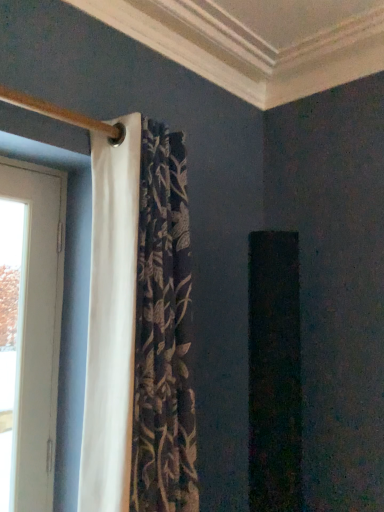
Question: From a real-world perspective, is white wood door at left over white fabric curtain at left?

Choices:
 (A) no
 (B) yes

Answer: (A)

Question: Is white fabric curtain at left at the back of white wood door at left?

Choices:
 (A) no
 (B) yes

Answer: (A)

Question: Is white wood door at left next to white fabric curtain at left and touching it?

Choices:
 (A) no
 (B) yes

Answer: (A)

Question: Is the position of white wood door at left less distant than that of white fabric curtain at left?

Choices:
 (A) yes
 (B) no

Answer: (B)

Question: Is white wood door at left not close to white fabric curtain at left?

Choices:
 (A) no
 (B) yes

Answer: (A)

Question: From the image's perspective, would you say white wood door at left is positioned over white fabric curtain at left?

Choices:
 (A) no
 (B) yes

Answer: (A)

Question: Is white fabric curtain at left next to white wood door at left and touching it?

Choices:
 (A) yes
 (B) no

Answer: (B)

Question: Is white fabric curtain at left at the right side of white wood door at left?

Choices:
 (A) yes
 (B) no

Answer: (A)

Question: Is white fabric curtain at left not within white wood door at left?

Choices:
 (A) yes
 (B) no

Answer: (A)

Question: Is white fabric curtain at left wider than white wood door at left?

Choices:
 (A) yes
 (B) no

Answer: (A)

Question: Is white wood door at left located within white fabric curtain at left?

Choices:
 (A) yes
 (B) no

Answer: (B)

Question: Is white fabric curtain at left oriented towards white wood door at left?

Choices:
 (A) yes
 (B) no

Answer: (B)

Question: Is white fabric curtain at left taller or shorter than white wood door at left?

Choices:
 (A) short
 (B) tall

Answer: (B)